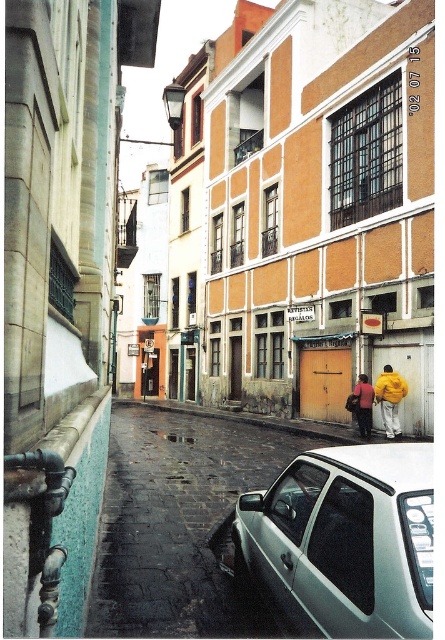
You are a delivery person standing at the entrance of the building on the right. You need to park your white glossy car at lower right at point (178, 522). Is there enough space to park there?

The white glossy car at lower right is located at point (178, 522), so there is enough space to park there.

Looking at this image, you are a delivery person needing to park your 1.8 meter wide van in this narrow street. You see a white matte car at lower right and a yellow fabric jacket at lower right. Which vehicle space can you use if the jacket is placed on the driver side of the car?

The white matte car at lower right has a width larger than the yellow fabric jacket at lower right. Since the jacket is placed on the driver side of the car, the space next to the white matte car at lower right may be wider and suitable for parking your van, provided there is enough clearance. However, you should ensure that the total available space between the car and other obstacles accommodates your van safely.

You are a delivery person standing at the entrance of the street. You need to deliver two packages to the recipients wearing the yellow matte jacket at lower right and the yellow fabric jacket at lower right. The delivery cart you have can only carry items that are narrower than the narrowest jacket. Can you determine which jacket is narrower?

The yellow fabric jacket at lower right is narrower than the yellow matte jacket at lower right since the yellow matte jacket at lower right has a greater width.